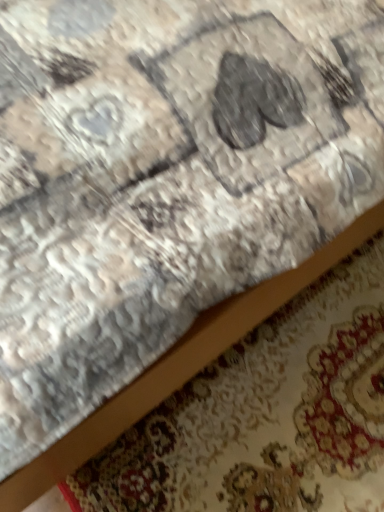
This screenshot has height=512, width=384. I want to click on blank area beneath velvety beige mat at center (from a real-world perspective), so click(x=286, y=411).